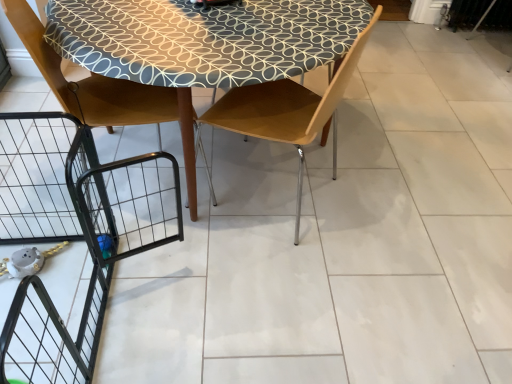
Question: From the image's perspective, is matte brown chair at left, which ranks as the first chair in left-to-right order, positioned above or below wooden chair at center, which is counted as the 1th chair, starting from the right?

Choices:
 (A) above
 (B) below

Answer: (A)

Question: Does point (48, 79) appear closer or farther from the camera than point (266, 107)?

Choices:
 (A) farther
 (B) closer

Answer: (B)

Question: Considering their positions, is matte brown chair at left, the 2th chair in the right-to-left sequence, located in front of or behind wooden chair at center, which is counted as the 1th chair, starting from the right?

Choices:
 (A) behind
 (B) front

Answer: (A)

Question: Does point (309, 110) appear closer or farther from the camera than point (109, 97)?

Choices:
 (A) closer
 (B) farther

Answer: (A)

Question: Is wooden chair at center, which ranks as the 2th chair in left-to-right order, inside or outside of matte brown chair at left, which ranks as the first chair in left-to-right order?

Choices:
 (A) inside
 (B) outside

Answer: (B)

Question: Is wooden chair at center, which is counted as the 1th chair, starting from the right, bigger or smaller than matte brown chair at left, the 2th chair in the right-to-left sequence?

Choices:
 (A) big
 (B) small

Answer: (B)

Question: From the image's perspective, is wooden chair at center, which ranks as the 2th chair in left-to-right order, above or below matte brown chair at left, the 2th chair in the right-to-left sequence?

Choices:
 (A) below
 (B) above

Answer: (A)